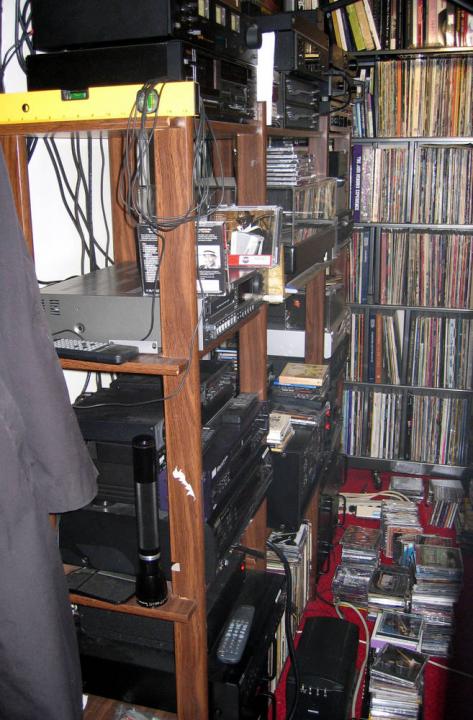
Where is `record player`? This screenshot has height=720, width=473. record player is located at coordinates [318, 216].